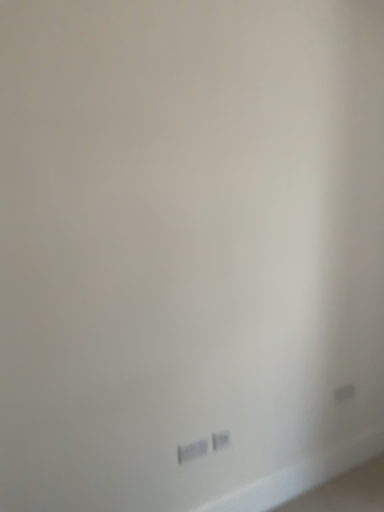
Question: Is white plastic power plug at lower center, positioned as the 1th power plugs and sockets in back-to-front order, inside or outside of white plastic power plugs and sockets at lower center, which is the 2th power plugs and sockets in back-to-front order?

Choices:
 (A) inside
 (B) outside

Answer: (B)

Question: Is white plastic power plug at lower center, which is counted as the first power plugs and sockets, starting from the right, taller or shorter than white plastic power plugs and sockets at lower center, which is the 2th power plugs and sockets in back-to-front order?

Choices:
 (A) short
 (B) tall

Answer: (B)

Question: From the image's perspective, is white plastic power plug at lower center, the second power plugs and sockets viewed from the left, positioned above or below white plastic power plugs and sockets at lower center, which is the 2th power plugs and sockets in back-to-front order?

Choices:
 (A) below
 (B) above

Answer: (B)

Question: Considering their positions, is white plastic power plugs and sockets at lower center, which is counted as the second power plugs and sockets, starting from the right, located in front of or behind white plastic power plug at lower center, positioned as the 1th power plugs and sockets in back-to-front order?

Choices:
 (A) behind
 (B) front

Answer: (B)

Question: Considering the positions of white plastic power plugs and sockets at lower center, which is counted as the second power plugs and sockets, starting from the right, and white plastic power plug at lower center, the second power plugs and sockets viewed from the left, in the image, is white plastic power plugs and sockets at lower center, which is counted as the second power plugs and sockets, starting from the right, bigger or smaller than white plastic power plug at lower center, the second power plugs and sockets viewed from the left,?

Choices:
 (A) small
 (B) big

Answer: (B)

Question: Does point (198, 442) appear closer or farther from the camera than point (220, 445)?

Choices:
 (A) closer
 (B) farther

Answer: (A)

Question: Looking at their shapes, would you say white plastic power plugs and sockets at lower center, the 1th power plugs and sockets when ordered from front to back, is wider or thinner than white plastic power plug at lower center, which is counted as the first power plugs and sockets, starting from the right?

Choices:
 (A) thin
 (B) wide

Answer: (B)